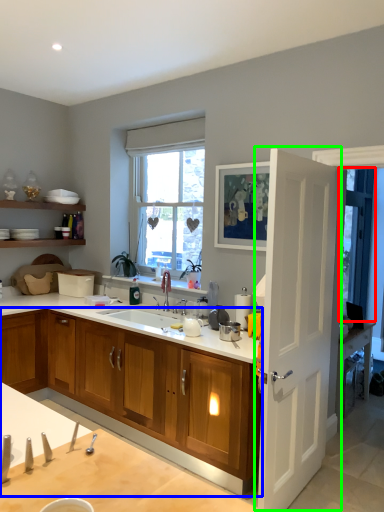
Question: Which object is the closest to the window screen (highlighted by a red box)? Choose among these: cabinetry (highlighted by a blue box) or door (highlighted by a green box).

Choices:
 (A) cabinetry
 (B) door

Answer: (B)